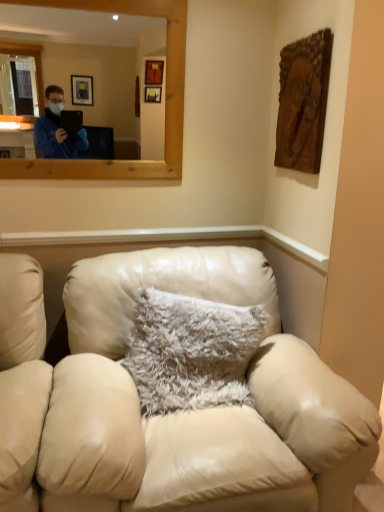
Question: Looking at their shapes, would you say leather couch at center is wider or thinner than fuzzy white pillow at center?

Choices:
 (A) thin
 (B) wide

Answer: (B)

Question: Looking at the image, does leather couch at center seem bigger or smaller compared to fuzzy white pillow at center?

Choices:
 (A) big
 (B) small

Answer: (A)

Question: Which of these objects is positioned farthest from the wooden mirror at upper center?

Choices:
 (A) leather couch at center
 (B) fuzzy white pillow at center

Answer: (A)

Question: Which is nearer to the fuzzy white pillow at center?

Choices:
 (A) leather couch at center
 (B) wooden mirror at upper center

Answer: (A)